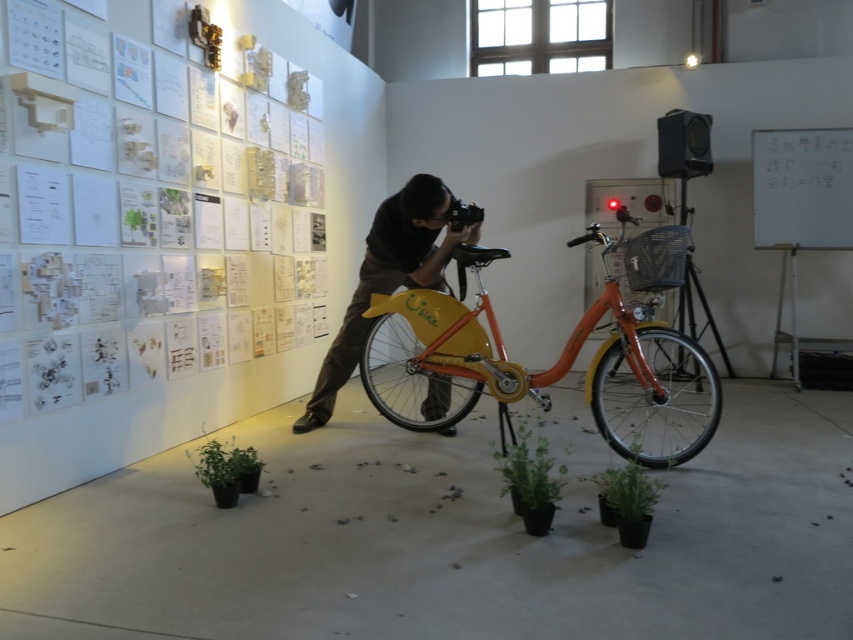
In the scene shown: You are an interior designer planning to add a new plant to the space. The green matte plant at lower center is currently in the room. You have a new plant that is 1.2 meters tall. Will the new plant be taller than the white paper posters at upper left?

The white paper posters at upper left is much taller as green matte plant at lower center, so the new plant at 1.2 meters will be shorter than the white paper posters at upper left.

You are standing in the gallery and want to place a small plant exactly at the center of the room. Is the green matte plant at center already positioned correctly?

The green matte plant at center is already positioned correctly at point (x=529, y=472).